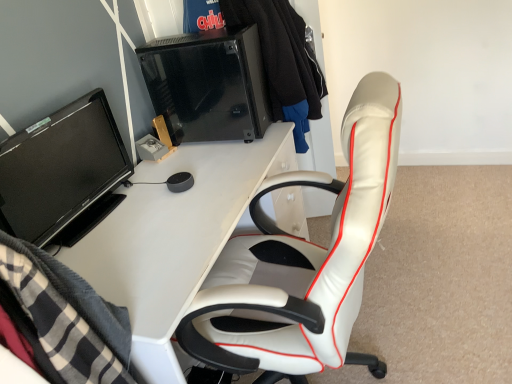
Question: Does white glossy desk at center touch white leather chair at right?

Choices:
 (A) yes
 (B) no

Answer: (B)

Question: Does white glossy desk at center have a lesser width compared to white leather chair at right?

Choices:
 (A) yes
 (B) no

Answer: (A)

Question: Are white glossy desk at center and white leather chair at right far apart?

Choices:
 (A) yes
 (B) no

Answer: (B)

Question: Is white glossy desk at center further to the viewer compared to white leather chair at right?

Choices:
 (A) yes
 (B) no

Answer: (A)

Question: Is white glossy desk at center turned away from white leather chair at right?

Choices:
 (A) yes
 (B) no

Answer: (B)

Question: Does white glossy desk at center have a larger size compared to white leather chair at right?

Choices:
 (A) yes
 (B) no

Answer: (A)

Question: Is white leather chair at right to the left of white glossy desk at center from the viewer's perspective?

Choices:
 (A) no
 (B) yes

Answer: (A)

Question: From a real-world perspective, is white leather chair at right physically below white glossy desk at center?

Choices:
 (A) yes
 (B) no

Answer: (B)

Question: Is white leather chair at right shorter than white glossy desk at center?

Choices:
 (A) no
 (B) yes

Answer: (A)

Question: Does white leather chair at right appear on the right side of white glossy desk at center?

Choices:
 (A) no
 (B) yes

Answer: (B)

Question: Is the position of white leather chair at right more distant than that of white glossy desk at center?

Choices:
 (A) no
 (B) yes

Answer: (A)

Question: Does white leather chair at right have a lesser width compared to white glossy desk at center?

Choices:
 (A) yes
 (B) no

Answer: (B)

Question: From a real-world perspective, is black fabric jacket at upper center on top of black glass desktop computer at upper center?

Choices:
 (A) no
 (B) yes

Answer: (B)